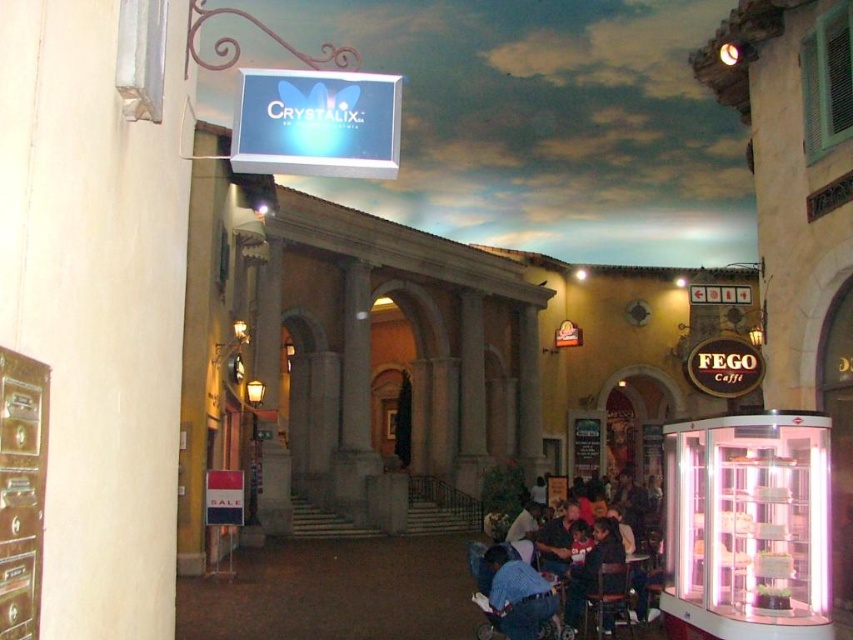
You are a customer looking for a specific store in the mall. You see a blue denim shirt at center and a dark blue shirt at lower right. Which shirt is closer to the Crystalix store sign on the left?

The dark blue shirt at lower right is closer to the Crystalix store sign on the left because the blue denim shirt at center is positioned on the right side of it, placing the dark blue shirt at lower right nearer to the left side of the image where the Crystalix sign is located.

You are a customer in the shopping arcade looking to purchase a shirt. You see a blue denim shirt at center and a dark blue shirt at lower right. Which shirt is wider?

The blue denim shirt at center is wider than the dark blue shirt at lower right.